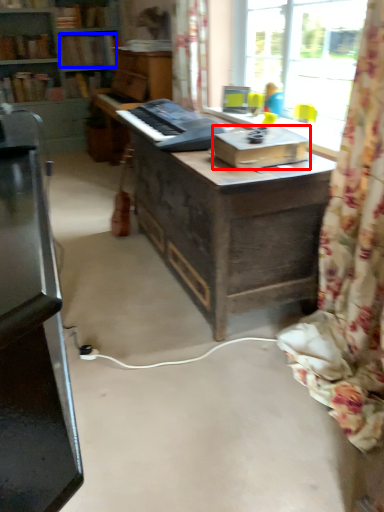
Question: Which object is closer to the camera taking this photo, cardboard box (highlighted by a red box) or book (highlighted by a blue box)?

Choices:
 (A) cardboard box
 (B) book

Answer: (A)